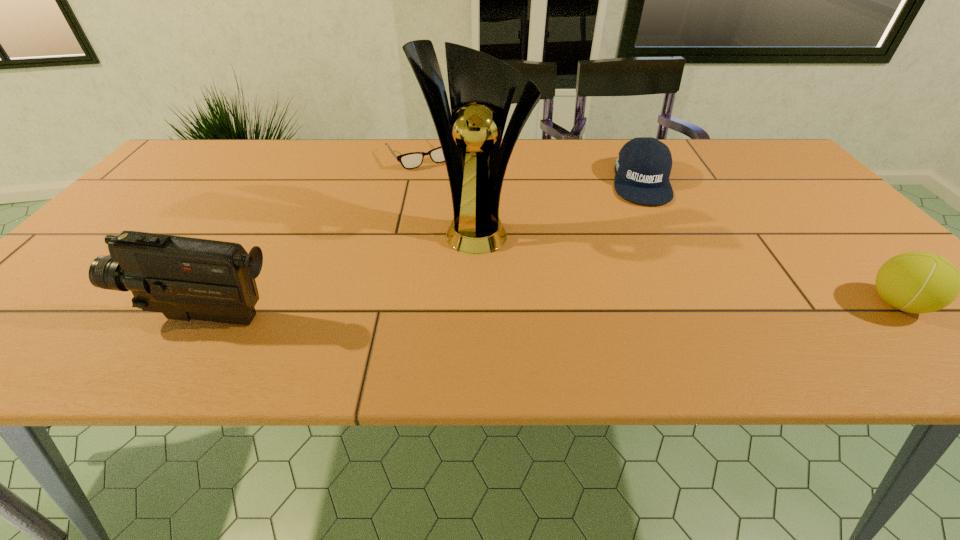
Locate an element on the screen. The image size is (960, 540). free space on the desktop that is between the camcorder and the tennis ball and is positioned on the front-facing side of the baseball cap is located at coordinates (660, 308).

Image resolution: width=960 pixels, height=540 pixels. Find the location of `vacant space on the desktop that is between the leftmost object and the tennis ball and is positioned on the front-facing side of the spectacles`. vacant space on the desktop that is between the leftmost object and the tennis ball and is positioned on the front-facing side of the spectacles is located at coordinates coord(536,311).

Identify the location of free space on the desktop that is between the leftmost object and the tennis ball and is positioned at the front of the award, where the globe is visible. The height and width of the screenshot is (540, 960). (x=468, y=312).